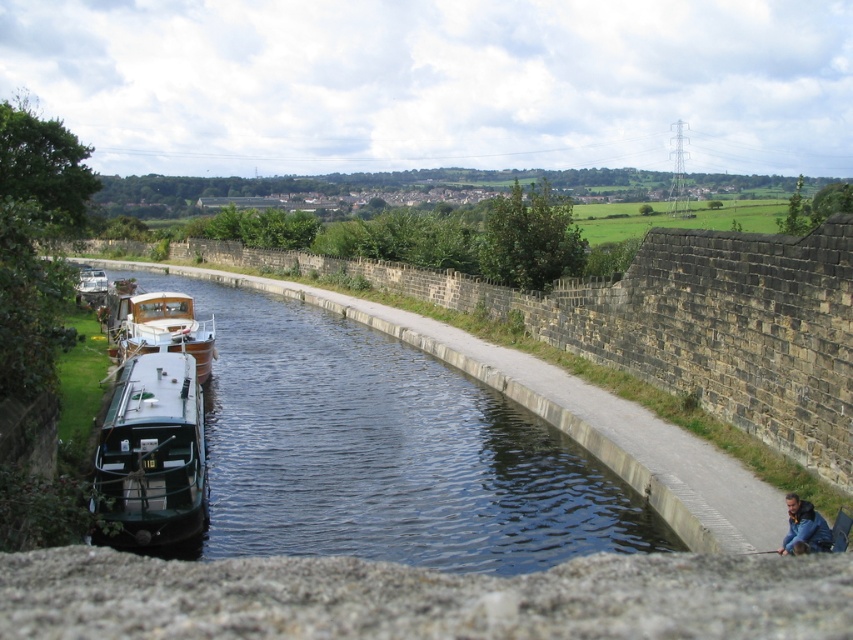
Question: Is wooden polished boat at center in front of blue denim jacket at lower right?

Choices:
 (A) no
 (B) yes

Answer: (A)

Question: Is green rubber boat at left closer to camera compared to blue denim jacket at lower right?

Choices:
 (A) no
 (B) yes

Answer: (A)

Question: Which point is farther to the camera?

Choices:
 (A) (793, 538)
 (B) (126, 372)

Answer: (B)

Question: Among these points, which one is farthest from the camera?

Choices:
 (A) (793, 552)
 (B) (169, 328)
 (C) (378, 442)

Answer: (B)

Question: Is wooden polished boat at center smaller than green matte boat at left?

Choices:
 (A) no
 (B) yes

Answer: (B)

Question: Estimate the real-world distances between objects in this image. Which object is closer to the green rubber boat at left?

Choices:
 (A) green matte boat at left
 (B) wooden polished boat at center
 (C) blue denim jacket at lower right

Answer: (B)